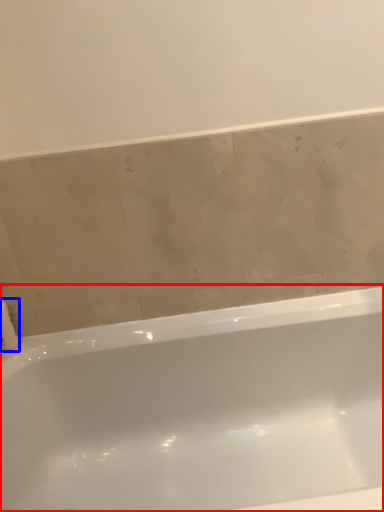
Question: Which of the following is the farthest to the observer, bathtub (highlighted by a red box) or toilet paper (highlighted by a blue box)?

Choices:
 (A) bathtub
 (B) toilet paper

Answer: (B)